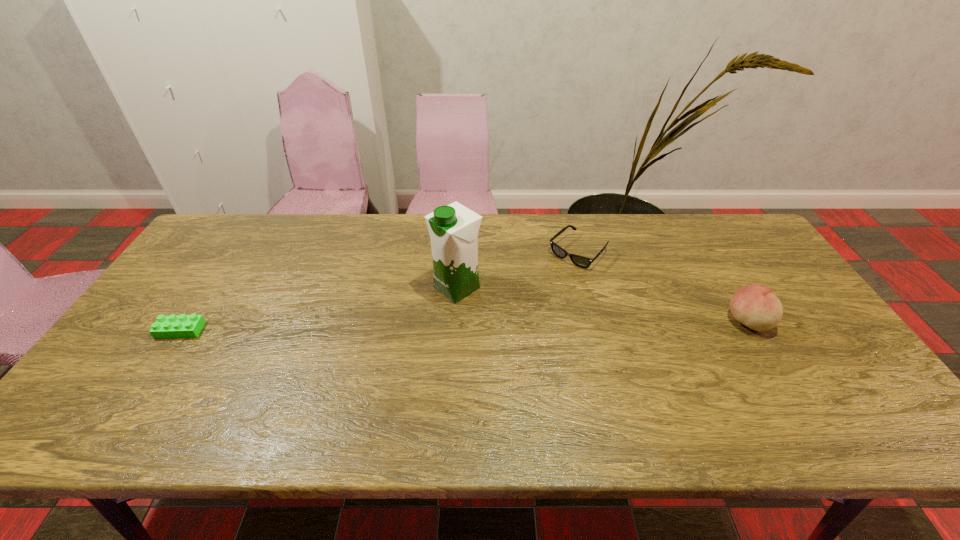
Locate an element on the screen. vacant space at the near edge of the desktop is located at coordinates (348, 388).

Identify the location of vacant region at the left edge of the desktop. point(146,347).

Locate an element on the screen. Image resolution: width=960 pixels, height=540 pixels. free region at the right edge of the desktop is located at coordinates (817, 326).

The width and height of the screenshot is (960, 540). Identify the location of vacant space at the far right corner of the desktop. (719, 215).

Identify the location of vacant space that is in between the rightmost object and the Lego. (464, 326).

The width and height of the screenshot is (960, 540). Identify the location of free space that is in between the soya milk and the rightmost object. (602, 305).

Locate an element on the screen. unoccupied area between the sunglasses and the shortest object is located at coordinates (379, 291).

Locate an element on the screen. The image size is (960, 540). free point between the second object from right to left and the third object from right to left is located at coordinates (517, 270).

The width and height of the screenshot is (960, 540). I want to click on free space between the peach and the soya milk, so click(602, 305).

The width and height of the screenshot is (960, 540). Identify the location of empty space that is in between the tallest object and the shortest object. (319, 309).